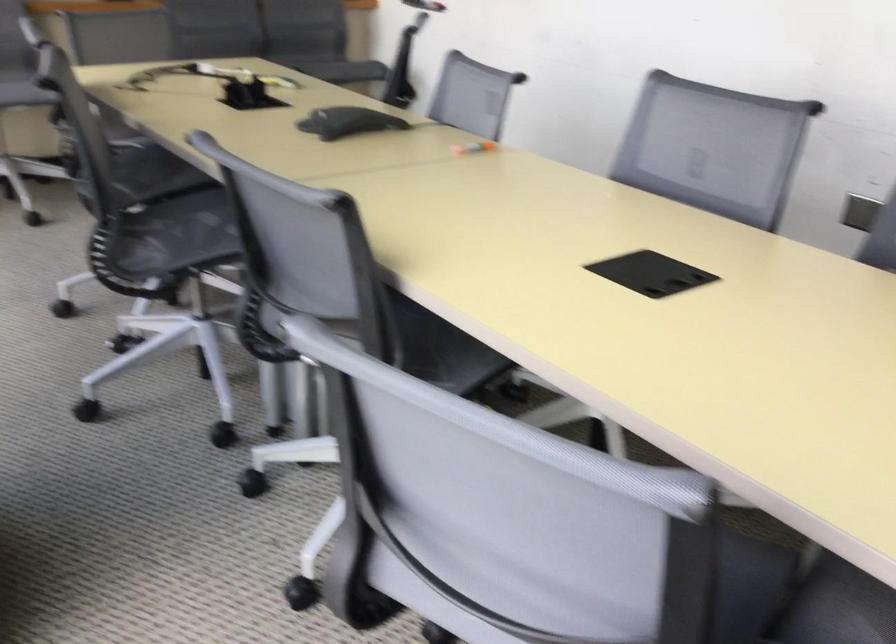
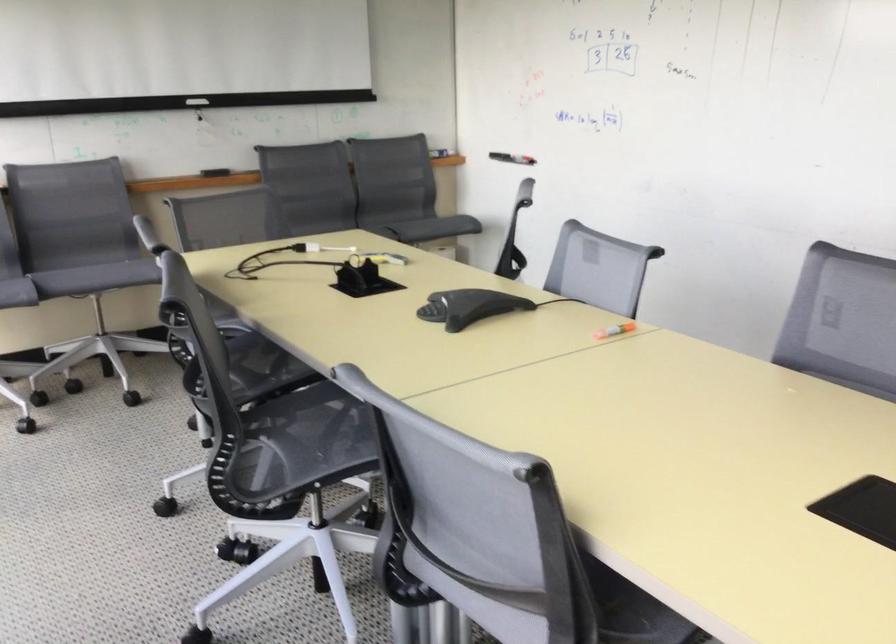
Question: The images are taken continuously from a first-person perspective. In which direction is your viewpoint rotating?

Choices:
 (A) Left
 (B) Right
 (C) Up
 (D) Down

Answer: (C)